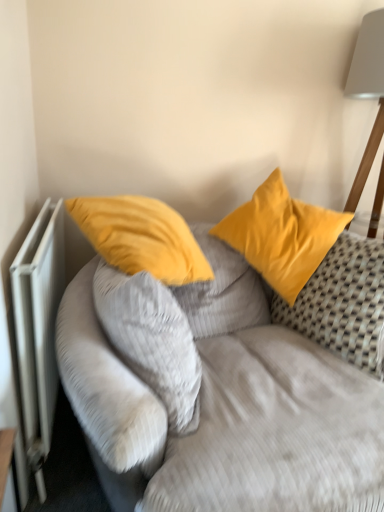
Identify the location of white metallic radiator at left. Image resolution: width=384 pixels, height=512 pixels. (39, 329).

The image size is (384, 512). Describe the element at coordinates (39, 329) in the screenshot. I see `white metallic radiator at left` at that location.

Describe the element at coordinates (224, 406) in the screenshot. I see `velvet yellow pillows at upper center` at that location.

What is the approximate height of satin yellow pillow at upper right, which is the 1th pillow from right to left?

satin yellow pillow at upper right, which is the 1th pillow from right to left, is 67.91 centimeters in height.

You are a GUI agent. You are given a task and a screenshot of the screen. Output one action in this format:
    pyautogui.click(x=<x>, y=<y>)
    Task: Click on the white metallic radiator at left
    The width and height of the screenshot is (384, 512).
    Given the screenshot: What is the action you would take?
    pyautogui.click(x=39, y=329)

Locate an element on the screen. This screenshot has width=384, height=512. radiator on the left of velvet yellow pillows at upper center is located at coordinates pyautogui.click(x=39, y=329).

From the picture: From the image's perspective, relative to white metallic radiator at left, is velvet yellow pillows at upper center above or below?

Clearly, from the image's perspective, velvet yellow pillows at upper center is below white metallic radiator at left.

Is point (283, 500) positioned after point (25, 354)?

No.

Considering the sizes of objects velvet yellow pillows at upper center and white metallic radiator at left in the image provided, who is taller, velvet yellow pillows at upper center or white metallic radiator at left?

Standing taller between the two is velvet yellow pillows at upper center.

How many degrees apart are the facing directions of white metallic radiator at left and matte yellow pillow at center, the second pillow when ordered from right to left?

The angular difference between white metallic radiator at left and matte yellow pillow at center, the second pillow when ordered from right to left, is 11.6 degrees.

Consider the image. Is white metallic radiator at left positioned far away from matte yellow pillow at center, which is the 1th pillow from left to right?

No, there isn't a large distance between white metallic radiator at left and matte yellow pillow at center, which is the 1th pillow from left to right.

Is white metallic radiator at left to the left or to the right of matte yellow pillow at center, the second pillow when ordered from right to left, in the image?

Based on their positions, white metallic radiator at left is located to the left of matte yellow pillow at center, the second pillow when ordered from right to left.

Is white metallic radiator at left facing away from matte yellow pillow at center, which is the 1th pillow from left to right?

No, white metallic radiator at left is not facing the opposite direction of matte yellow pillow at center, which is the 1th pillow from left to right.

Which object is more forward, matte yellow pillow at center, which is the 1th pillow from left to right, or satin yellow pillow at upper right, which is the second pillow in left-to-right order?

matte yellow pillow at center, which is the 1th pillow from left to right.

Are matte yellow pillow at center, the second pillow when ordered from right to left, and satin yellow pillow at upper right, which is the 1th pillow from right to left, far apart?

That's not correct — matte yellow pillow at center, the second pillow when ordered from right to left, is a little close to satin yellow pillow at upper right, which is the 1th pillow from right to left.

From the image's perspective, is matte yellow pillow at center, the second pillow when ordered from right to left, over satin yellow pillow at upper right, which is the 1th pillow from right to left?

Actually, matte yellow pillow at center, the second pillow when ordered from right to left, appears below satin yellow pillow at upper right, which is the 1th pillow from right to left, in the image.

Which is behind, velvet yellow pillows at upper center or satin yellow pillow at upper right, which is the 1th pillow from right to left?

satin yellow pillow at upper right, which is the 1th pillow from right to left, is further away from the camera.

Is velvet yellow pillows at upper center placed right next to satin yellow pillow at upper right, which is the 1th pillow from right to left?

velvet yellow pillows at upper center and satin yellow pillow at upper right, which is the 1th pillow from right to left, are not in contact.

Looking at this image, which of these two, velvet yellow pillows at upper center or satin yellow pillow at upper right, which is the 1th pillow from right to left, is thinner?

With smaller width is satin yellow pillow at upper right, which is the 1th pillow from right to left.

Image resolution: width=384 pixels, height=512 pixels. In order to click on studio couch on the left of satin yellow pillow at upper right, which is the 1th pillow from right to left in this screenshot , I will do `click(224, 406)`.

Does satin yellow pillow at upper right, which is the second pillow in left-to-right order, have a greater width compared to white metallic radiator at left?

Indeed, satin yellow pillow at upper right, which is the second pillow in left-to-right order, has a greater width compared to white metallic radiator at left.

From the image's perspective, between satin yellow pillow at upper right, which is the 1th pillow from right to left, and white metallic radiator at left, which one is located above?

satin yellow pillow at upper right, which is the 1th pillow from right to left, is shown above in the image.

Can white metallic radiator at left be found inside satin yellow pillow at upper right, which is the 1th pillow from right to left?

No, white metallic radiator at left is not inside satin yellow pillow at upper right, which is the 1th pillow from right to left.

Does white metallic radiator at left have a greater height compared to satin yellow pillow at upper right, which is the second pillow in left-to-right order?

Yes, white metallic radiator at left is taller than satin yellow pillow at upper right, which is the second pillow in left-to-right order.

From a real-world perspective, which is physically above, white metallic radiator at left or satin yellow pillow at upper right, which is the 1th pillow from right to left?

satin yellow pillow at upper right, which is the 1th pillow from right to left, is physically above.

From the image's perspective, is white metallic radiator at left located beneath satin yellow pillow at upper right, which is the second pillow in left-to-right order?

Yes, from the image's perspective, white metallic radiator at left is below satin yellow pillow at upper right, which is the second pillow in left-to-right order.

Looking at their sizes, would you say white metallic radiator at left is wider or thinner than satin yellow pillow at upper right, which is the 1th pillow from right to left?

Considering their sizes, white metallic radiator at left looks slimmer than satin yellow pillow at upper right, which is the 1th pillow from right to left.

Between satin yellow pillow at upper right, which is the 1th pillow from right to left, and matte yellow pillow at center, the second pillow when ordered from right to left, which one has more height?

With more height is satin yellow pillow at upper right, which is the 1th pillow from right to left.

Is satin yellow pillow at upper right, which is the 1th pillow from right to left, looking in the opposite direction of matte yellow pillow at center, the second pillow when ordered from right to left?

satin yellow pillow at upper right, which is the 1th pillow from right to left, is not turned away from matte yellow pillow at center, the second pillow when ordered from right to left.

From the image's perspective, which is below, satin yellow pillow at upper right, which is the 1th pillow from right to left, or matte yellow pillow at center, the second pillow when ordered from right to left?

From the image's view, matte yellow pillow at center, the second pillow when ordered from right to left, is below.

Which of these two, satin yellow pillow at upper right, which is the 1th pillow from right to left, or matte yellow pillow at center, which is the 1th pillow from left to right, is bigger?

satin yellow pillow at upper right, which is the 1th pillow from right to left, is bigger.

What are the coordinates of `radiator that is above the velvet yellow pillows at upper center (from the image's perspective)` in the screenshot? It's located at (39, 329).

The width and height of the screenshot is (384, 512). I want to click on radiator located below the matte yellow pillow at center, the second pillow when ordered from right to left (from the image's perspective), so coord(39,329).

Considering their positions, is white metallic radiator at left positioned closer to matte yellow pillow at center, the second pillow when ordered from right to left, than satin yellow pillow at upper right, which is the second pillow in left-to-right order?

The object closer to matte yellow pillow at center, the second pillow when ordered from right to left, is white metallic radiator at left.

From the image, which object appears to be nearer to white metallic radiator at left, matte yellow pillow at center, the second pillow when ordered from right to left, or velvet yellow pillows at upper center?

matte yellow pillow at center, the second pillow when ordered from right to left, is closer to white metallic radiator at left.

Estimate the real-world distances between objects in this image. Which object is closer to velvet yellow pillows at upper center, satin yellow pillow at upper right, which is the 1th pillow from right to left, or white metallic radiator at left?

satin yellow pillow at upper right, which is the 1th pillow from right to left, lies closer to velvet yellow pillows at upper center than the other object.

When comparing their distances from velvet yellow pillows at upper center, does matte yellow pillow at center, which is the 1th pillow from left to right, or satin yellow pillow at upper right, which is the 1th pillow from right to left, seem further?

satin yellow pillow at upper right, which is the 1th pillow from right to left, is positioned further to the anchor velvet yellow pillows at upper center.

From the image, which object appears to be farther from satin yellow pillow at upper right, which is the 1th pillow from right to left, velvet yellow pillows at upper center or matte yellow pillow at center, the second pillow when ordered from right to left?

matte yellow pillow at center, the second pillow when ordered from right to left, lies further to satin yellow pillow at upper right, which is the 1th pillow from right to left, than the other object.

From the picture: Which object lies nearer to the anchor point satin yellow pillow at upper right, which is the second pillow in left-to-right order, white metallic radiator at left or velvet yellow pillows at upper center?

velvet yellow pillows at upper center.

Based on the photo, based on their spatial positions, is satin yellow pillow at upper right, which is the second pillow in left-to-right order, or velvet yellow pillows at upper center further from white metallic radiator at left?

satin yellow pillow at upper right, which is the second pillow in left-to-right order, lies further to white metallic radiator at left than the other object.

Looking at the image, which one is located further to white metallic radiator at left, velvet yellow pillows at upper center or matte yellow pillow at center, which is the 1th pillow from left to right?

The object further to white metallic radiator at left is velvet yellow pillows at upper center.

I want to click on studio couch between white metallic radiator at left and satin yellow pillow at upper right, which is the 1th pillow from right to left, from left to right, so click(224, 406).

Image resolution: width=384 pixels, height=512 pixels. Find the location of `pillow between velvet yellow pillows at upper center and satin yellow pillow at upper right, which is the 1th pillow from right to left, from front to back`. pillow between velvet yellow pillows at upper center and satin yellow pillow at upper right, which is the 1th pillow from right to left, from front to back is located at coordinates (152, 339).

You are a GUI agent. You are given a task and a screenshot of the screen. Output one action in this format:
    pyautogui.click(x=<x>, y=<y>)
    Task: Click on the pillow between white metallic radiator at left and satin yellow pillow at upper right, which is the 1th pillow from right to left, from left to right
    This screenshot has width=384, height=512.
    Given the screenshot: What is the action you would take?
    pyautogui.click(x=152, y=339)

Locate an element on the screen. pillow located between white metallic radiator at left and velvet yellow pillows at upper center in the left-right direction is located at coordinates (152, 339).